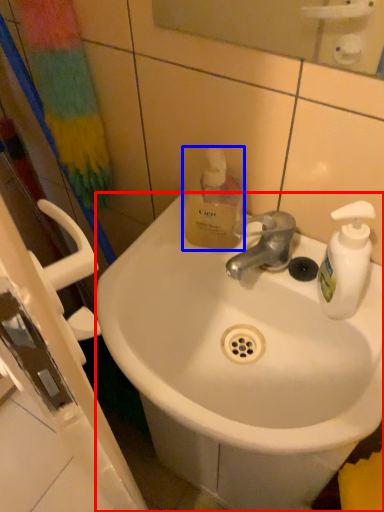
Question: Which of the following is the farthest to the observer, sink (highlighted by a red box) or bottle (highlighted by a blue box)?

Choices:
 (A) sink
 (B) bottle

Answer: (B)